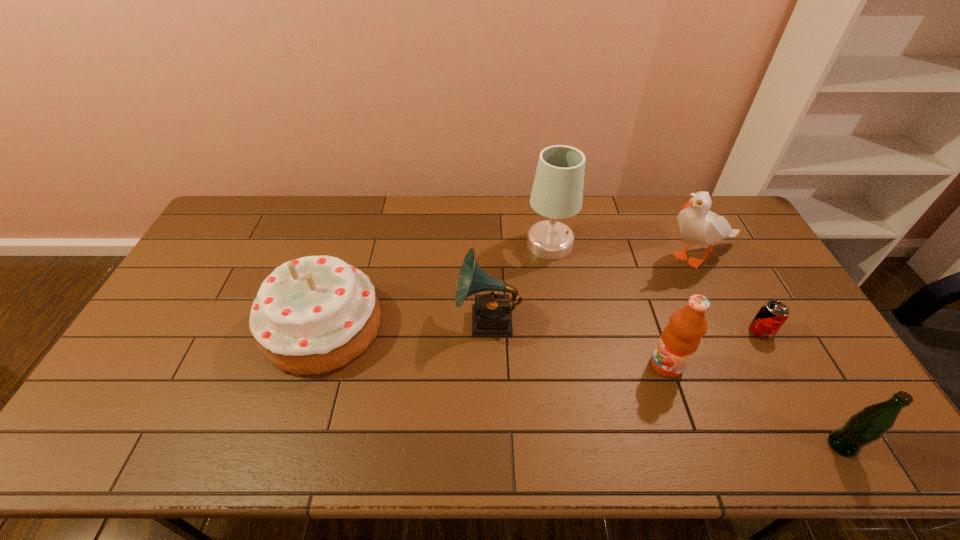
Where is `vacant point located 0.210m at the beak of the gull`? vacant point located 0.210m at the beak of the gull is located at coordinates (588, 258).

The height and width of the screenshot is (540, 960). I want to click on free space located at the beak of the gull, so click(x=632, y=258).

This screenshot has height=540, width=960. In order to click on vacant area located 0.070m on the front label of the fruit juice in this screenshot , I will do `click(624, 365)`.

Locate an element on the screen. The width and height of the screenshot is (960, 540). vacant space located 0.220m on the front label of the fruit juice is located at coordinates (568, 365).

Where is `free location located 0.210m on the front label of the fruit juice`? This screenshot has width=960, height=540. free location located 0.210m on the front label of the fruit juice is located at coordinates (572, 365).

Identify the location of vacant point located from the horn of the phonograph_record. The width and height of the screenshot is (960, 540). (389, 320).

This screenshot has width=960, height=540. I want to click on free space located from the horn of the phonograph_record, so click(413, 320).

Locate an element on the screen. This screenshot has width=960, height=540. vacant space located from the horn of the phonograph_record is located at coordinates (361, 320).

This screenshot has height=540, width=960. Identify the location of vacant space located 0.180m on the back of the leftmost object. (348, 246).

Find the location of a particular element. Image resolution: width=960 pixels, height=540 pixels. free region located 0.220m on the back of the beer bottle is located at coordinates (790, 355).